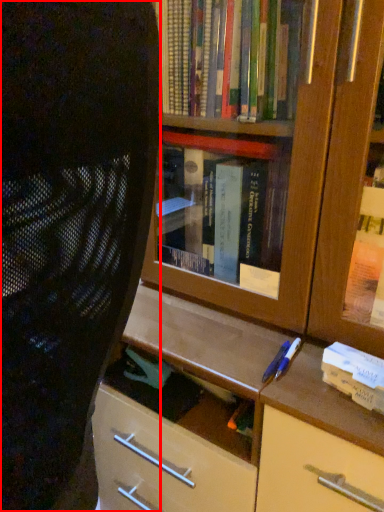
Question: In this image, where is person (annotated by the red box) located relative to paperback book?

Choices:
 (A) right
 (B) left

Answer: (B)